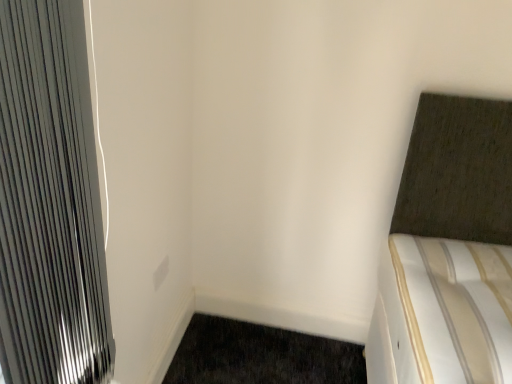
This screenshot has height=384, width=512. Identify the location of metallic silver radiator at left. (50, 202).

The image size is (512, 384). What are the coordinates of `dark brown carpet at lower left` in the screenshot? It's located at (261, 356).

Is white matte electric outlet at center beside metallic silver radiator at left?

No, white matte electric outlet at center is not with metallic silver radiator at left.

Visually, is white matte electric outlet at center positioned to the left or to the right of metallic silver radiator at left?

Based on their positions, white matte electric outlet at center is located to the left of metallic silver radiator at left.

From a real-world perspective, is white matte electric outlet at center beneath metallic silver radiator at left?

Yes, from a real-world perspective, white matte electric outlet at center is below metallic silver radiator at left.

Which is closer, [166,264] or [6,192]?

Clearly, point [166,264] is more distant from the camera than point [6,192].

From a real-world perspective, is white matte electric outlet at center on dark brown carpet at lower left?

Yes, from a real-world perspective, white matte electric outlet at center is on top of dark brown carpet at lower left.

Between white matte electric outlet at center and dark brown carpet at lower left, which one has more height?

white matte electric outlet at center is taller.

From the image's perspective, is white matte electric outlet at center on top of dark brown carpet at lower left?

Correct, white matte electric outlet at center appears higher than dark brown carpet at lower left in the image.

Is dark brown carpet at lower left looking in the opposite direction of metallic silver radiator at left?

dark brown carpet at lower left does not have its back to metallic silver radiator at left.

Can you confirm if dark brown carpet at lower left is taller than metallic silver radiator at left?

No, dark brown carpet at lower left is not taller than metallic silver radiator at left.

Considering the points (183, 367) and (82, 156), which point is behind, point (183, 367) or point (82, 156)?

The point (183, 367) is farther.

Is dark brown carpet at lower left behind white matte electric outlet at center?

That is True.

Can you see dark brown carpet at lower left touching white matte electric outlet at center?

No, dark brown carpet at lower left is not touching white matte electric outlet at center.

Where is `electric outlet that appears in front of the dark brown carpet at lower left`? This screenshot has height=384, width=512. electric outlet that appears in front of the dark brown carpet at lower left is located at coordinates (161, 273).

Which of these two, metallic silver radiator at left or white matte electric outlet at center, is thinner?

With smaller width is white matte electric outlet at center.

Between point (7, 251) and point (161, 281), which one is positioned in front?

Positioned in front is point (7, 251).

Looking at this image, in the image, is metallic silver radiator at left on the left side or the right side of white matte electric outlet at center?

Clearly, metallic silver radiator at left is on the right of white matte electric outlet at center in the image.

Which of these two, metallic silver radiator at left or white matte electric outlet at center, stands taller?

metallic silver radiator at left is taller.

The width and height of the screenshot is (512, 384). In order to click on doormat below the metallic silver radiator at left (from the image's perspective) in this screenshot , I will do `click(261, 356)`.

Does point (41, 286) come behind point (259, 367)?

That is False.

From the image's perspective, which one is positioned higher, metallic silver radiator at left or dark brown carpet at lower left?

metallic silver radiator at left appears higher in the image.

From a real-world perspective, is metallic silver radiator at left positioned over dark brown carpet at lower left based on gravity?

Indeed, from a real-world perspective, metallic silver radiator at left stands above dark brown carpet at lower left.

You are a GUI agent. You are given a task and a screenshot of the screen. Output one action in this format:
    pyautogui.click(x=<x>, y=<y>)
    Task: Click on the radiator above the white matte electric outlet at center (from the image's perspective)
    The width and height of the screenshot is (512, 384).
    Given the screenshot: What is the action you would take?
    pyautogui.click(x=50, y=202)

Locate an element on the screen. doormat that appears below the white matte electric outlet at center (from the image's perspective) is located at coordinates (261, 356).

From the image, which object appears to be farther from metallic silver radiator at left, white matte electric outlet at center or dark brown carpet at lower left?

dark brown carpet at lower left lies further to metallic silver radiator at left than the other object.

Looking at the image, which one is located closer to dark brown carpet at lower left, white matte electric outlet at center or metallic silver radiator at left?

Among the two, white matte electric outlet at center is located nearer to dark brown carpet at lower left.

Based on their spatial positions, is metallic silver radiator at left or white matte electric outlet at center closer to dark brown carpet at lower left?

white matte electric outlet at center lies closer to dark brown carpet at lower left than the other object.

From the image, which object appears to be farther from white matte electric outlet at center, metallic silver radiator at left or dark brown carpet at lower left?

Based on the image, metallic silver radiator at left appears to be further to white matte electric outlet at center.

Based on their spatial positions, is dark brown carpet at lower left or metallic silver radiator at left closer to white matte electric outlet at center?

Among the two, dark brown carpet at lower left is located nearer to white matte electric outlet at center.

Estimate the real-world distances between objects in this image. Which object is closer to metallic silver radiator at left, dark brown carpet at lower left or white matte electric outlet at center?

The object closer to metallic silver radiator at left is white matte electric outlet at center.

Where is `electric outlet between metallic silver radiator at left and dark brown carpet at lower left along the z-axis`? This screenshot has height=384, width=512. electric outlet between metallic silver radiator at left and dark brown carpet at lower left along the z-axis is located at coordinates (161, 273).